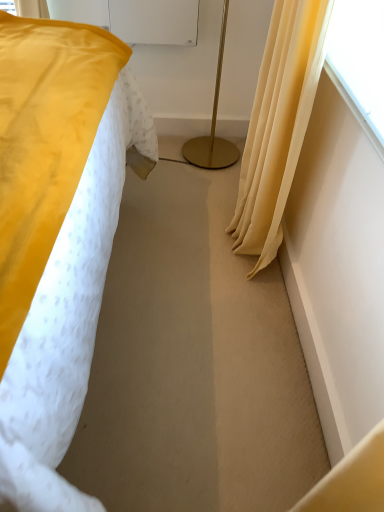
Identify the location of vacant space behind matte yellow curtain at right. (208, 189).